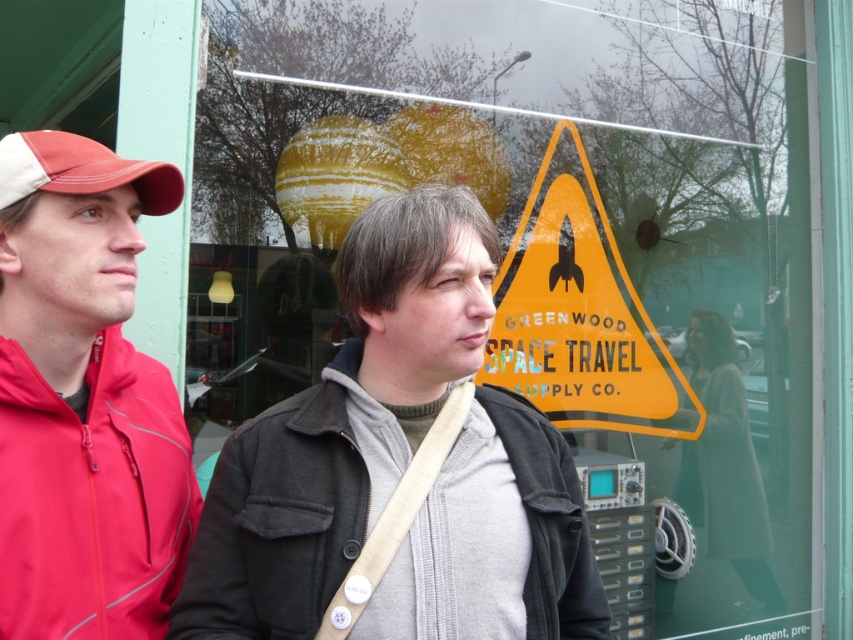
Question: Is dark gray cotton jacket at center to the right of white cotton dress at center from the viewer's perspective?

Choices:
 (A) no
 (B) yes

Answer: (A)

Question: Which of the following is the farthest from the observer?

Choices:
 (A) white cotton dress at center
 (B) yellowmaterial/texturewarning sign at center
 (C) red jacket at left

Answer: (A)

Question: Is dark gray cotton jacket at center to the left of matte red baseball cap at left from the viewer's perspective?

Choices:
 (A) no
 (B) yes

Answer: (A)

Question: Does white cotton dress at center lie in front of matte red baseball cap at left?

Choices:
 (A) yes
 (B) no

Answer: (B)

Question: Among these points, which one is farthest from the camera?

Choices:
 (A) (68, 177)
 (B) (491, 237)
 (C) (12, 189)
 (D) (201, 516)

Answer: (D)

Question: Which object is positioned closest to the yellowmaterial/texturewarning sign at center?

Choices:
 (A) dark gray cotton jacket at center
 (B) matte red baseball cap at left

Answer: (A)